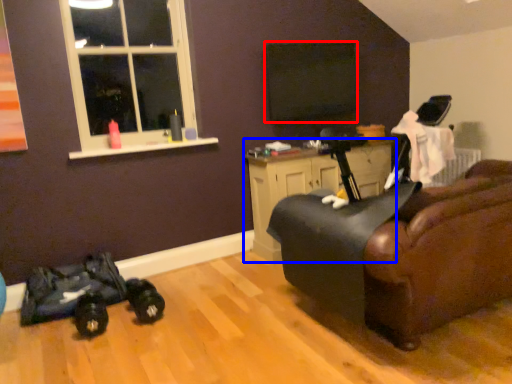
Question: Which point is further to the camera, window screen (highlighted by a red box) or cabinetry (highlighted by a blue box)?

Choices:
 (A) window screen
 (B) cabinetry

Answer: (A)